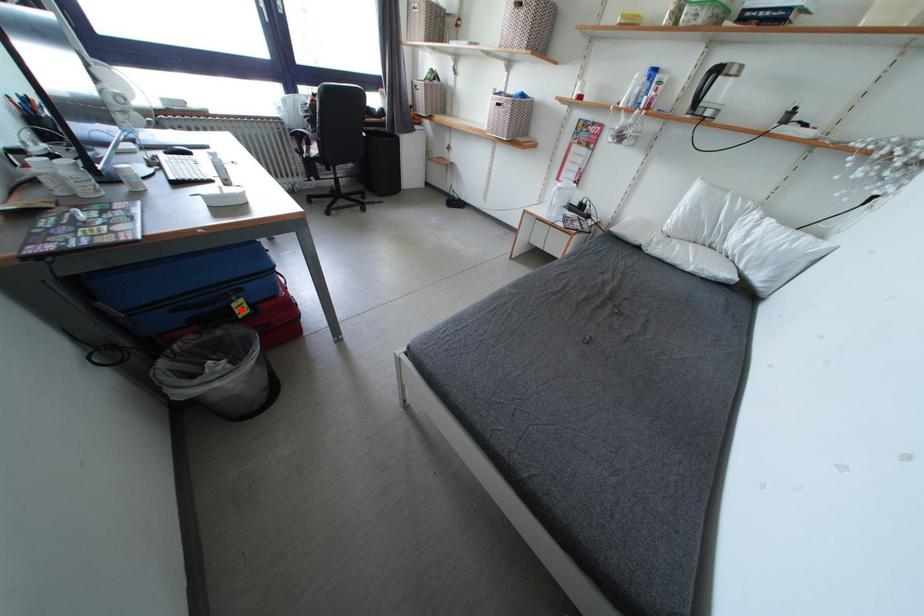
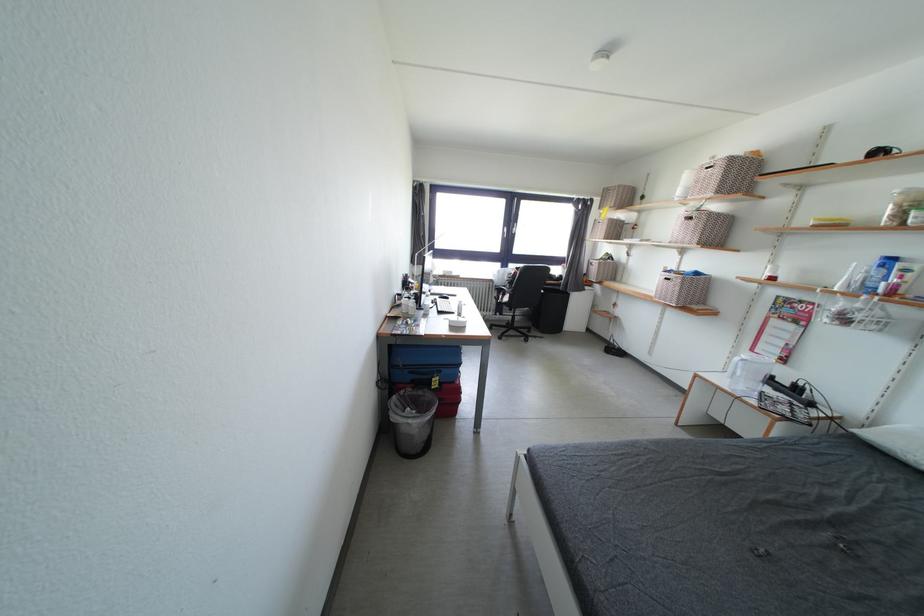
The point at the highlighted location is marked in the first image. Where is the corresponding point in the second image?

(440, 384)